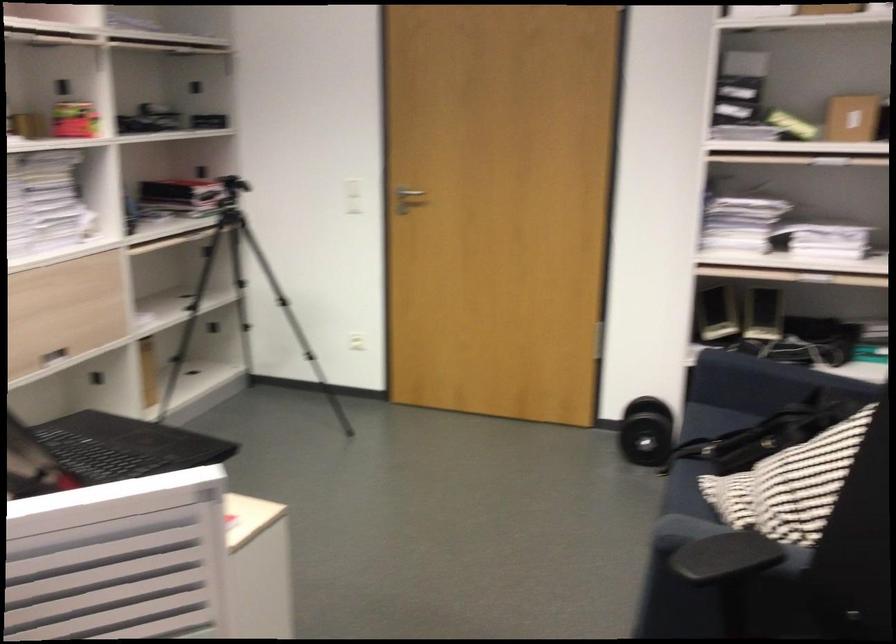
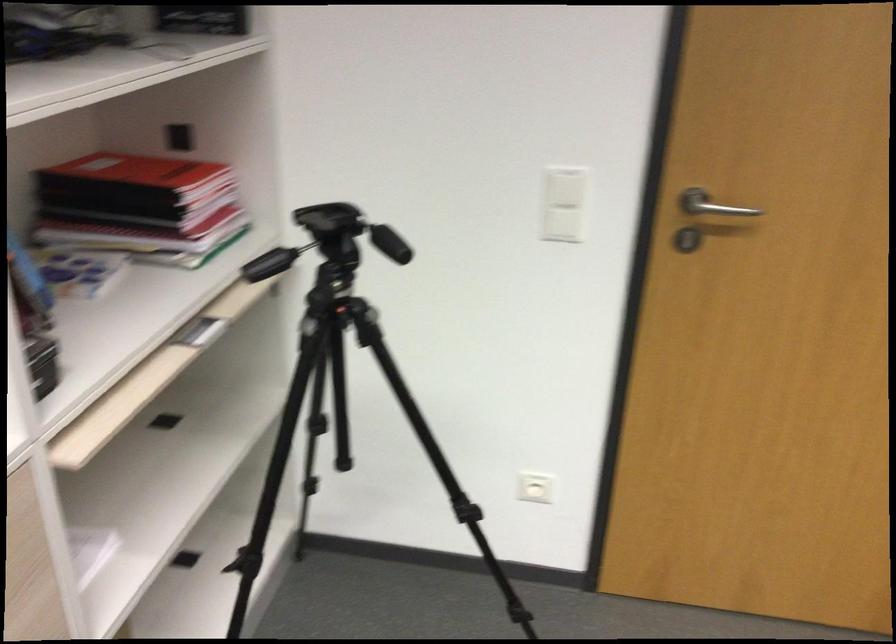
Where in the second image is the point corresponding to point (412, 187) from the first image?

(711, 205)